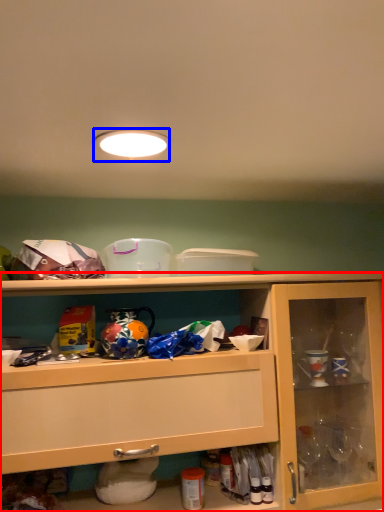
Question: Among these objects, which one is farthest to the camera, cabinetry (highlighted by a red box) or lighting (highlighted by a blue box)?

Choices:
 (A) cabinetry
 (B) lighting

Answer: (A)